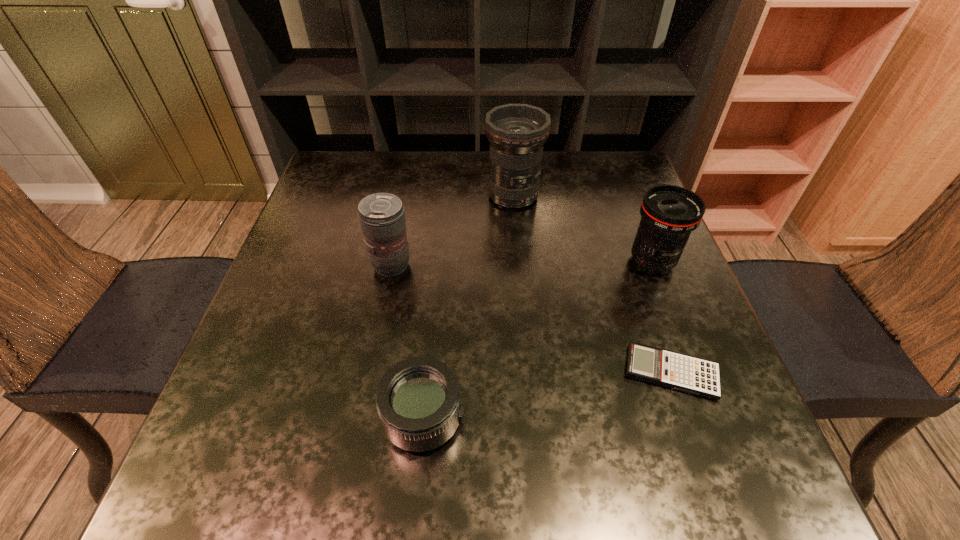
Image resolution: width=960 pixels, height=540 pixels. I want to click on the farthest object, so click(x=517, y=132).

Identify the location of the third object from left to right. The width and height of the screenshot is (960, 540). (517, 132).

Find the location of a particular element. the rightmost telephoto lens is located at coordinates (670, 213).

What are the coordinates of `the shortest telephoto lens` in the screenshot? It's located at (418, 400).

Locate an element on the screen. The image size is (960, 540). the nearest telephoto lens is located at coordinates (418, 400).

The image size is (960, 540). In order to click on calculator in this screenshot , I will do `click(696, 376)`.

Identify the location of vacant space located on the right of the farthest telephoto lens. The image size is (960, 540). (580, 195).

At what (x,y) coordinates should I click in order to perform the action: click on vacant space located on the back of the rightmost telephoto lens. Please return your answer as a coordinate pair (x, y). The image size is (960, 540). Looking at the image, I should click on (611, 156).

Locate an element on the screen. vacant space located on the side of the fourth tallest object with brand markings and control switches is located at coordinates (507, 418).

Find the location of a particular element. The width and height of the screenshot is (960, 540). free space located on the back of the shortest object is located at coordinates (628, 249).